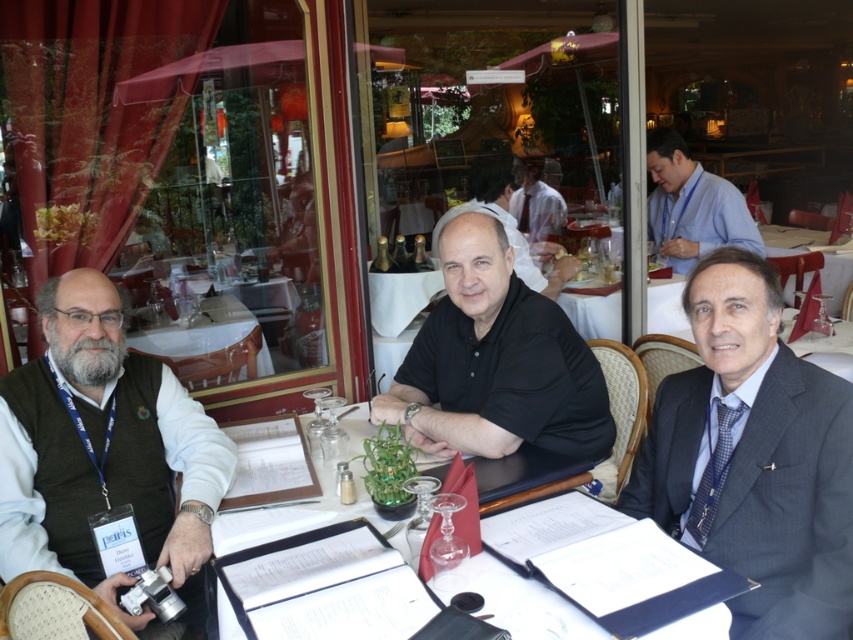
From the picture: Can you confirm if dark gray suit at right is smaller than black shirt at center?

Yes.

Can you confirm if dark gray suit at right is wider than black shirt at center?

In fact, dark gray suit at right might be narrower than black shirt at center.

Which is in front, point (683, 525) or point (445, 214)?

Point (683, 525) is in front.

I want to click on dark gray suit at right, so click(753, 458).

Is dark gray suit at right thinner than blue shirt at upper right?

Indeed, dark gray suit at right has a lesser width compared to blue shirt at upper right.

Who is more forward, (672,452) or (717,179)?

Point (672,452)

Which is behind, point (662, 474) or point (744, 205)?

Point (744, 205)

Identify the location of dark gray suit at right. Image resolution: width=853 pixels, height=640 pixels. (753, 458).

Is dark gray suit at right further to camera compared to dark green vest at left?

No, it is not.

Between point (780, 356) and point (44, 376), which one is positioned behind?

The point (44, 376) is more distant.

The width and height of the screenshot is (853, 640). I want to click on dark gray suit at right, so click(x=753, y=458).

At what (x,y) coordinates should I click in order to perform the action: click on dark gray suit at right. Please return your answer as a coordinate pair (x, y). The image size is (853, 640). Looking at the image, I should click on (753, 458).